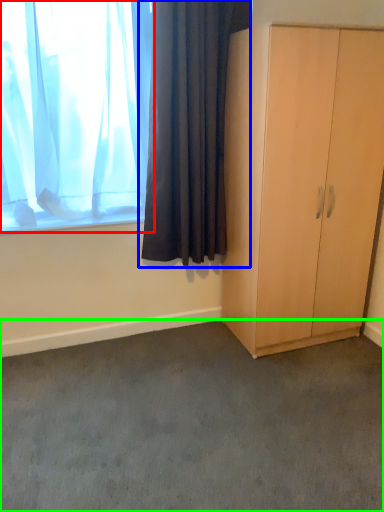
Question: Which object is the farthest from curtain (highlighted by a red box)? Choose among these: curtain (highlighted by a blue box) or plain (highlighted by a green box).

Choices:
 (A) curtain
 (B) plain

Answer: (B)